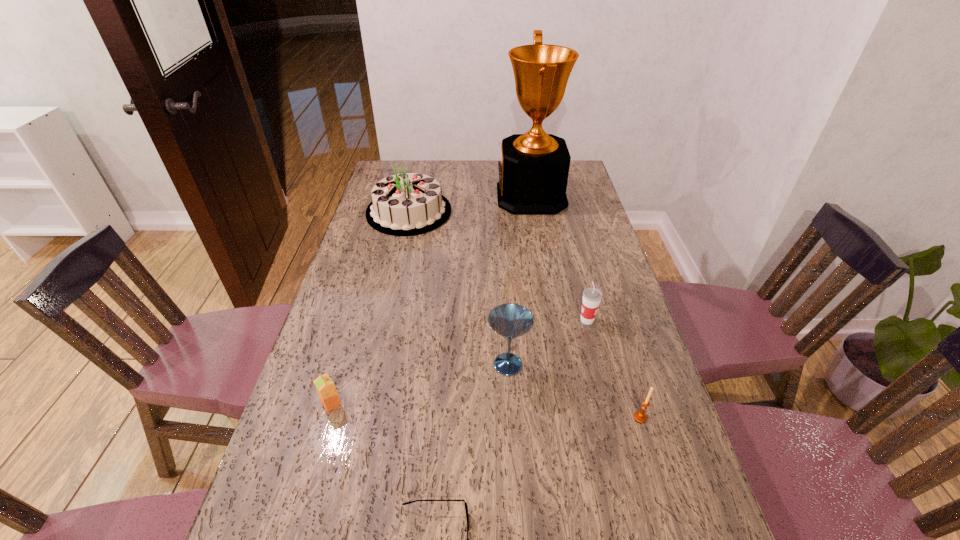
You are a GUI agent. You are given a task and a screenshot of the screen. Output one action in this format:
    pyautogui.click(x=<x>, y=<y>)
    Task: Click on the free space located on the front of the tallest object with the label
    
    Given the screenshot: What is the action you would take?
    423,197

Locate an element on the screen. free spot located 0.340m on the front of the tallest object with the label is located at coordinates (414, 197).

This screenshot has height=540, width=960. What are the coordinates of `vacant area situated 0.210m on the front of the second tallest object` in the screenshot? It's located at (395, 274).

What are the coordinates of `vacant space located 0.360m on the front of the fifth shortest object` in the screenshot? It's located at (518, 539).

Locate an element on the screen. This screenshot has width=960, height=540. vacant area located on the side of the fourth shortest object with the logo is located at coordinates (489, 320).

Where is `free spot located 0.150m on the side of the fourth shortest object with the logo`? free spot located 0.150m on the side of the fourth shortest object with the logo is located at coordinates (526, 320).

The width and height of the screenshot is (960, 540). Identify the location of free space located on the side of the fourth shortest object with the logo. (526, 320).

Where is `free spot located on the left of the candle_holder`? free spot located on the left of the candle_holder is located at coordinates (498, 417).

Where is `vacant space located on the back of the orange juice`? The width and height of the screenshot is (960, 540). vacant space located on the back of the orange juice is located at coordinates (348, 345).

Where is `object positioned at the far edge`? This screenshot has width=960, height=540. object positioned at the far edge is located at coordinates (533, 172).